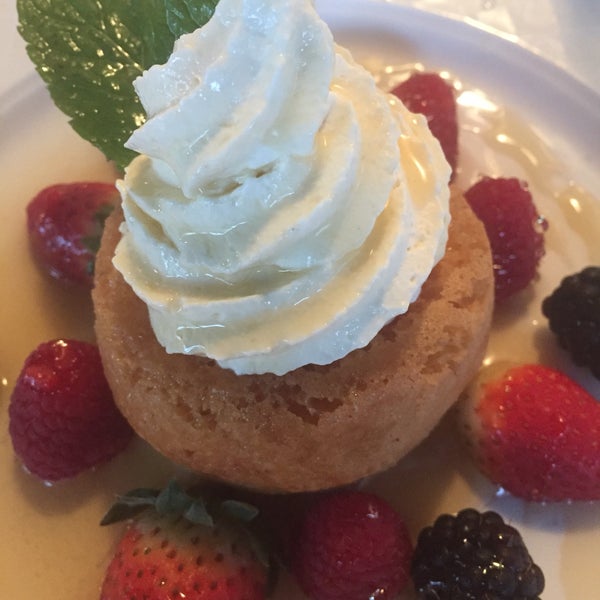
The image size is (600, 600). I want to click on table, so click(x=560, y=34).